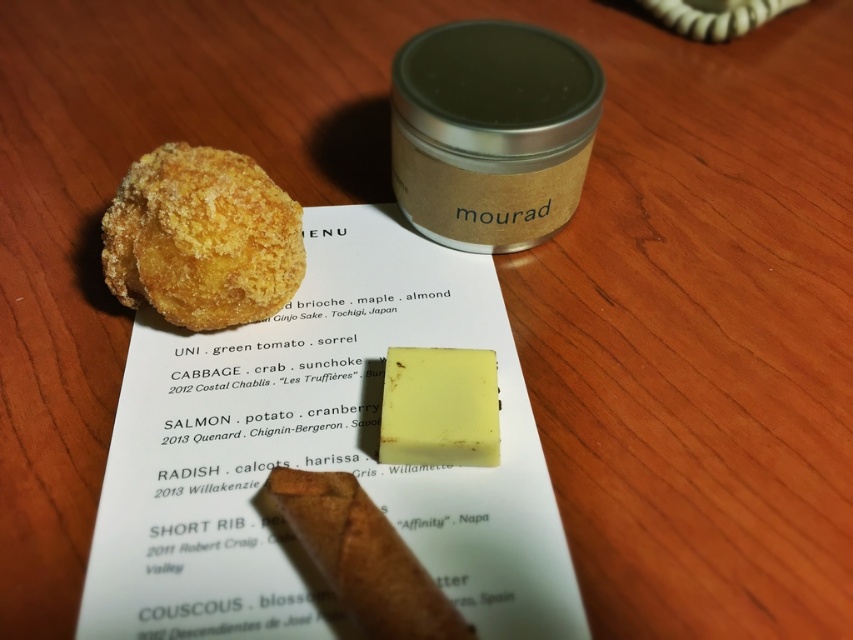
You are a food critic sitting at the table. You want to taste the golden crispy croquette at upper left but your hand can only reach 1 meter. Can you reach it?

The golden crispy croquette at upper left is 1.20 meters from viewer, so no, you cannot reach it with a 1 meter hand.

You are a food critic inspecting the table. You notice the golden crispy croquette at upper left and the yellow wax cheese at center. Which item is positioned higher on the table?

The golden crispy croquette at upper left is located above the yellow wax cheese at center, so it is positioned higher on the table.

You are a food critic who wants to compare the sizes of the golden crispy croquette at upper left and the yellow wax cheese at center on the table. Based on their positions, which one do you think is wider?

The golden crispy croquette at upper left is wider than the yellow wax cheese at center according to their widths.